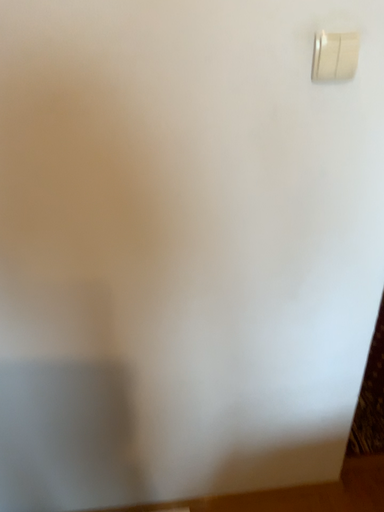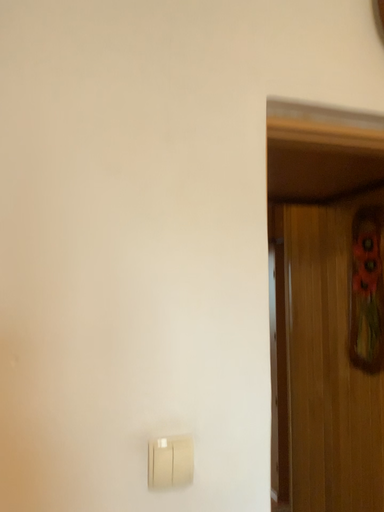
Question: How did the camera likely rotate when shooting the video?

Choices:
 (A) rotated upward
 (B) rotated downward

Answer: (A)